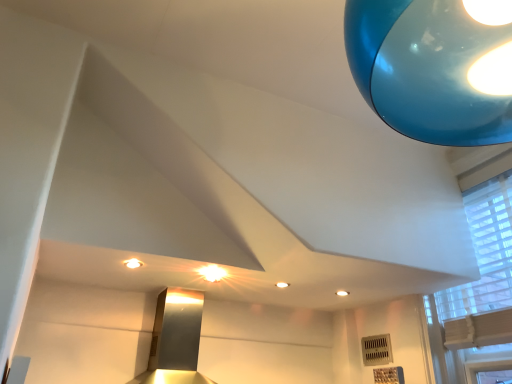
Question: Is matte white light fixture at upper center wider than white textured window at upper right?

Choices:
 (A) yes
 (B) no

Answer: (B)

Question: Would you say matte white light fixture at upper center contains white textured window at upper right?

Choices:
 (A) no
 (B) yes

Answer: (A)

Question: Is matte white light fixture at upper center next to white textured window at upper right?

Choices:
 (A) yes
 (B) no

Answer: (B)

Question: From a real-world perspective, is matte white light fixture at upper center positioned under white textured window at upper right based on gravity?

Choices:
 (A) yes
 (B) no

Answer: (A)

Question: From the image's perspective, does matte white light fixture at upper center appear higher than white textured window at upper right?

Choices:
 (A) no
 (B) yes

Answer: (B)

Question: Could you tell me if matte white light fixture at upper center is turned towards white textured window at upper right?

Choices:
 (A) no
 (B) yes

Answer: (A)

Question: Is matte white light fixture at upper center surrounded by white textured window at upper right?

Choices:
 (A) yes
 (B) no

Answer: (B)

Question: Can you confirm if white textured window at upper right is wider than matte white light fixture at upper center?

Choices:
 (A) yes
 (B) no

Answer: (A)

Question: From the image's perspective, does white textured window at upper right appear higher than matte white light fixture at upper center?

Choices:
 (A) no
 (B) yes

Answer: (A)

Question: From a real-world perspective, is white textured window at upper right beneath matte white light fixture at upper center?

Choices:
 (A) yes
 (B) no

Answer: (B)

Question: Is white textured window at upper right smaller than matte white light fixture at upper center?

Choices:
 (A) yes
 (B) no

Answer: (B)

Question: Is white textured window at upper right to the left of matte white light fixture at upper center from the viewer's perspective?

Choices:
 (A) no
 (B) yes

Answer: (A)

Question: Is matte white light fixture at upper center inside or outside of white textured window at upper right?

Choices:
 (A) inside
 (B) outside

Answer: (B)